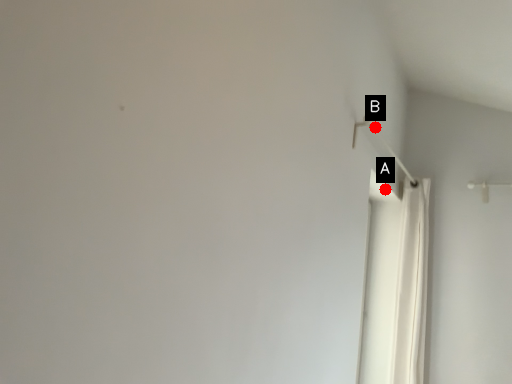
Question: Two points are circled on the image, labeled by A and B beside each circle. Which point appears closest to the camera in this image?

Choices:
 (A) A is closer
 (B) B is closer

Answer: (B)